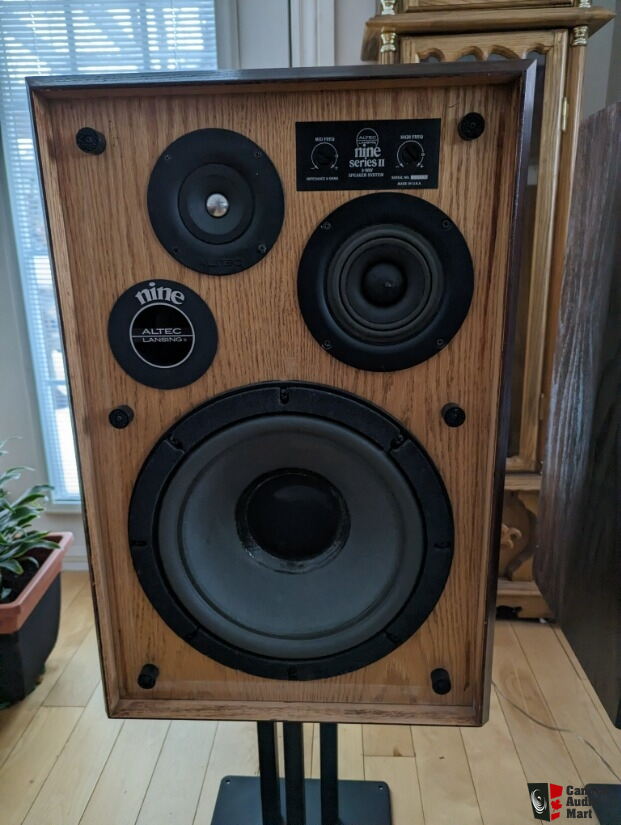
At what (x,y) coordinates should I click in order to perform the action: click on black metal speaker stand with three legs. Please return your answer as a coordinate pair (x, y). Looking at the image, I should click on (258, 738), (302, 733).